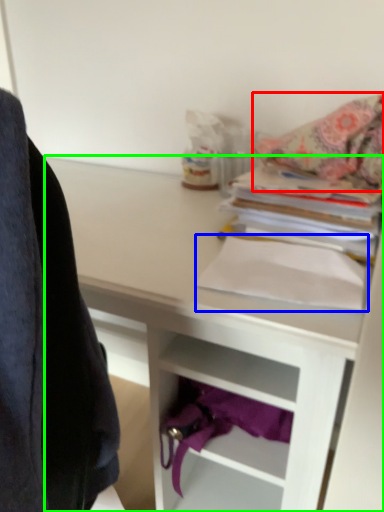
Question: Based on their relative distances, which object is farther from blanket (highlighted by a red box)? Choose from paperback book (highlighted by a blue box) and desk (highlighted by a green box).

Choices:
 (A) paperback book
 (B) desk

Answer: (B)